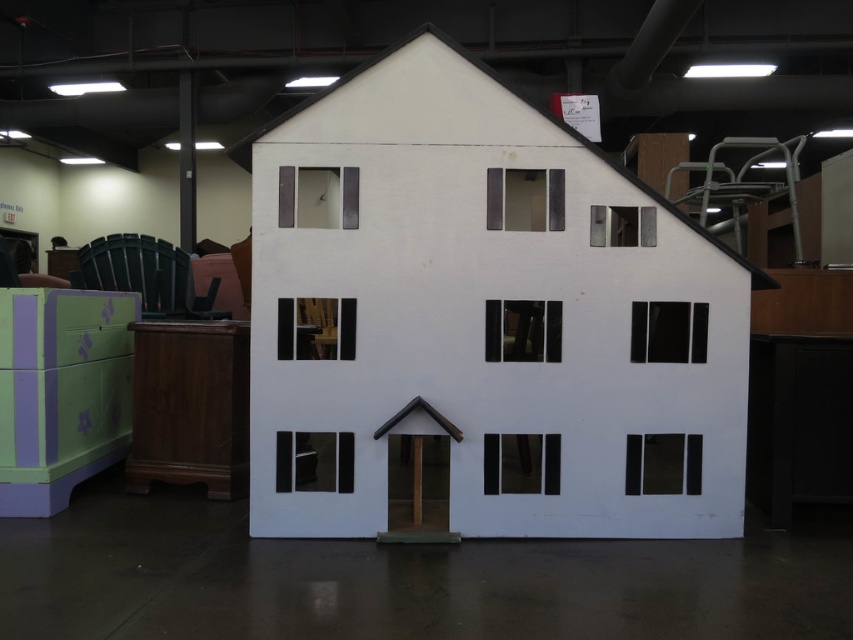
In the scene shown: Does white matte house at center appear on the left side of matte brown door at center?

No, white matte house at center is not to the left of matte brown door at center.

Is point (566, 444) positioned after point (424, 536)?

Yes, point (566, 444) is farther from viewer.

Which is behind, point (289, 282) or point (454, 532)?

Point (454, 532)

Locate an element on the screen. white matte house at center is located at coordinates (485, 316).